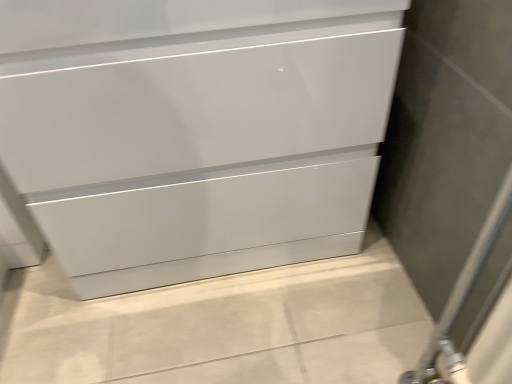
Question: Is glossy white chest of drawers at center positioned before matte gray screen door at right?

Choices:
 (A) yes
 (B) no

Answer: (B)

Question: Can you confirm if glossy white chest of drawers at center is smaller than matte gray screen door at right?

Choices:
 (A) yes
 (B) no

Answer: (B)

Question: Is glossy white chest of drawers at center positioned with its back to matte gray screen door at right?

Choices:
 (A) yes
 (B) no

Answer: (B)

Question: Does glossy white chest of drawers at center have a larger size compared to matte gray screen door at right?

Choices:
 (A) no
 (B) yes

Answer: (B)

Question: Can you confirm if glossy white chest of drawers at center is wider than matte gray screen door at right?

Choices:
 (A) yes
 (B) no

Answer: (A)

Question: Is the position of glossy white chest of drawers at center more distant than that of matte gray screen door at right?

Choices:
 (A) yes
 (B) no

Answer: (A)

Question: Does matte gray screen door at right have a smaller size compared to glossy white chest of drawers at center?

Choices:
 (A) no
 (B) yes

Answer: (B)

Question: Is matte gray screen door at right outside of glossy white chest of drawers at center?

Choices:
 (A) no
 (B) yes

Answer: (B)

Question: Is matte gray screen door at right bigger than glossy white chest of drawers at center?

Choices:
 (A) no
 (B) yes

Answer: (A)

Question: Can you confirm if matte gray screen door at right is taller than glossy white chest of drawers at center?

Choices:
 (A) no
 (B) yes

Answer: (B)

Question: Is matte gray screen door at right turned away from glossy white chest of drawers at center?

Choices:
 (A) yes
 (B) no

Answer: (B)

Question: Does matte gray screen door at right have a lesser height compared to glossy white chest of drawers at center?

Choices:
 (A) yes
 (B) no

Answer: (B)

Question: From a real-world perspective, relative to matte gray screen door at right, is glossy white chest of drawers at center vertically above or below?

Choices:
 (A) above
 (B) below

Answer: (B)